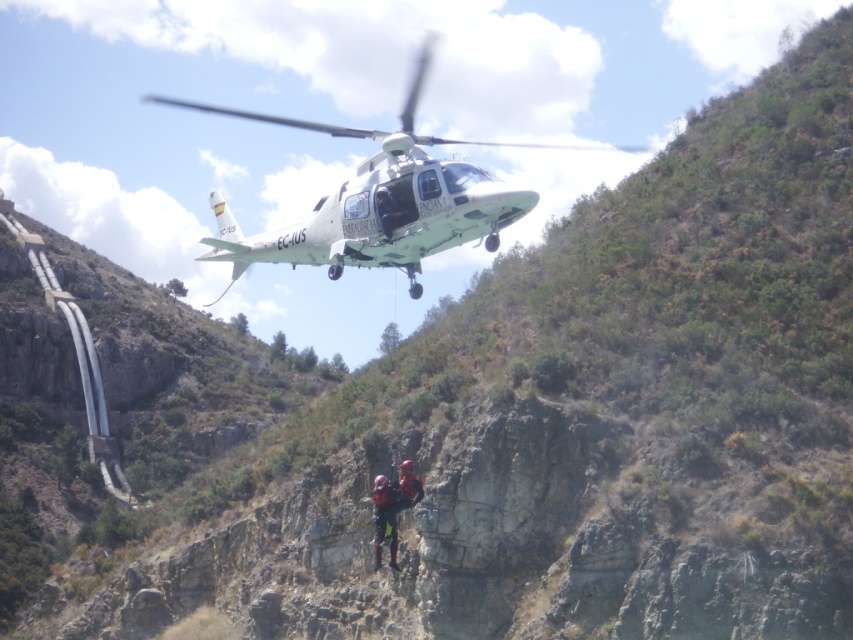
You are a safety inspector reviewing a rescue operation. You notice two helmets at the center of the image. Which helmet is closer to the helicopter? The black rubber helmet at center or the camouflage fabric helmet at center?

The black rubber helmet at center is closer to the helicopter because the camouflage fabric helmet at center is positioned behind it.

You are a rescue worker trying to locate two individuals on a cliff. You see two points marked on your map corresponding to their locations. The first point is at coordinates point (321, 221) and the second is at point (374, 532). According to the scene description, which point is closer to the helicopter hovering above the cliff?

Point (321, 221) is in front of point (374, 532), so it is closer to the helicopter hovering above the cliff.

You are a drone operator trying to capture a photo of two points on the cliffside. The first point is at coordinates point (387, 147) and the second point is at point (383, 513). Which point is closer to your camera?

Point (387, 147) is closer to the camera than point (383, 513).